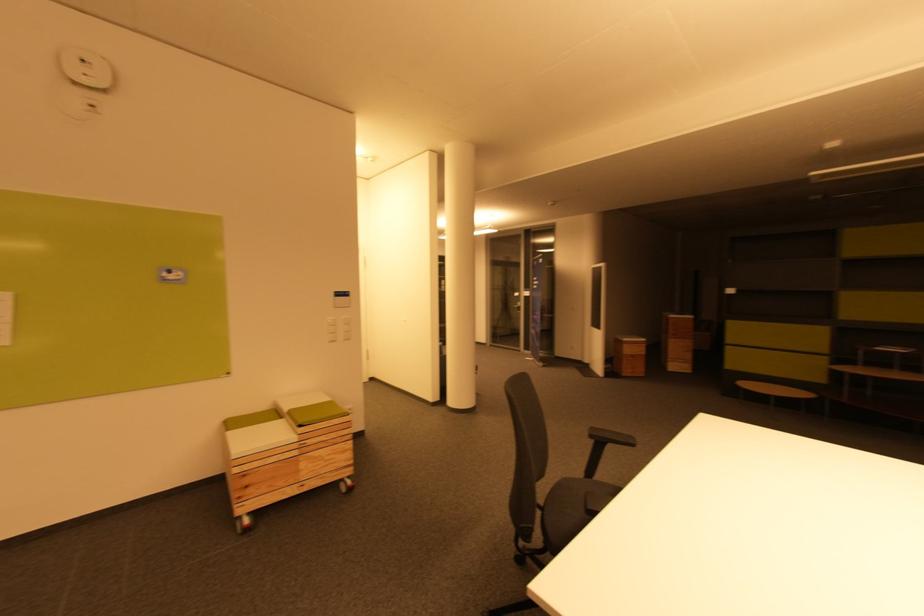
The image size is (924, 616). Describe the element at coordinates (611, 437) in the screenshot. I see `a chair armrest` at that location.